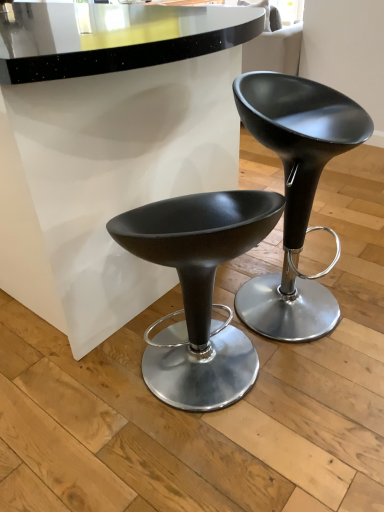
Question: Does matte black stool at center, positioned as the 2th stool in left-to-right order, have a lesser height compared to matte black stool at center, the first stool when ordered from left to right?

Choices:
 (A) no
 (B) yes

Answer: (A)

Question: Is matte black stool at center, positioned as the 2th stool in left-to-right order, aimed at matte black stool at center, the first stool when ordered from left to right?

Choices:
 (A) yes
 (B) no

Answer: (B)

Question: Does matte black stool at center, which is the 1th stool in right-to-left order, appear on the left side of matte black stool at center, the 2th stool when ordered from right to left?

Choices:
 (A) no
 (B) yes

Answer: (A)

Question: Is matte black stool at center, positioned as the 2th stool in left-to-right order, positioned beyond the bounds of matte black stool at center, the 2th stool when ordered from right to left?

Choices:
 (A) no
 (B) yes

Answer: (B)

Question: From a real-world perspective, is matte black stool at center, which is the 1th stool in right-to-left order, located higher than matte black stool at center, the 2th stool when ordered from right to left?

Choices:
 (A) no
 (B) yes

Answer: (B)

Question: Is there a large distance between matte black stool at center, positioned as the 2th stool in left-to-right order, and matte black stool at center, the first stool when ordered from left to right?

Choices:
 (A) yes
 (B) no

Answer: (B)

Question: Considering the relative positions of matte black stool at center, the first stool when ordered from left to right, and matte black stool at center, which is the 1th stool in right-to-left order, in the image provided, is matte black stool at center, the first stool when ordered from left to right, in front of matte black stool at center, which is the 1th stool in right-to-left order,?

Choices:
 (A) no
 (B) yes

Answer: (B)

Question: Does matte black stool at center, the first stool when ordered from left to right, touch matte black stool at center, positioned as the 2th stool in left-to-right order?

Choices:
 (A) yes
 (B) no

Answer: (B)

Question: Is matte black stool at center, the first stool when ordered from left to right, turned away from matte black stool at center, which is the 1th stool in right-to-left order?

Choices:
 (A) no
 (B) yes

Answer: (A)

Question: Does matte black stool at center, the 2th stool when ordered from right to left, turn towards matte black stool at center, positioned as the 2th stool in left-to-right order?

Choices:
 (A) no
 (B) yes

Answer: (A)

Question: Is matte black stool at center, the 2th stool when ordered from right to left, not inside matte black stool at center, positioned as the 2th stool in left-to-right order?

Choices:
 (A) no
 (B) yes

Answer: (B)

Question: Is matte black stool at center, the first stool when ordered from left to right, to the left of matte black stool at center, positioned as the 2th stool in left-to-right order, from the viewer's perspective?

Choices:
 (A) no
 (B) yes

Answer: (B)

Question: Is matte black stool at center, the 2th stool when ordered from right to left, situated inside matte black stool at center, positioned as the 2th stool in left-to-right order, or outside?

Choices:
 (A) outside
 (B) inside

Answer: (A)